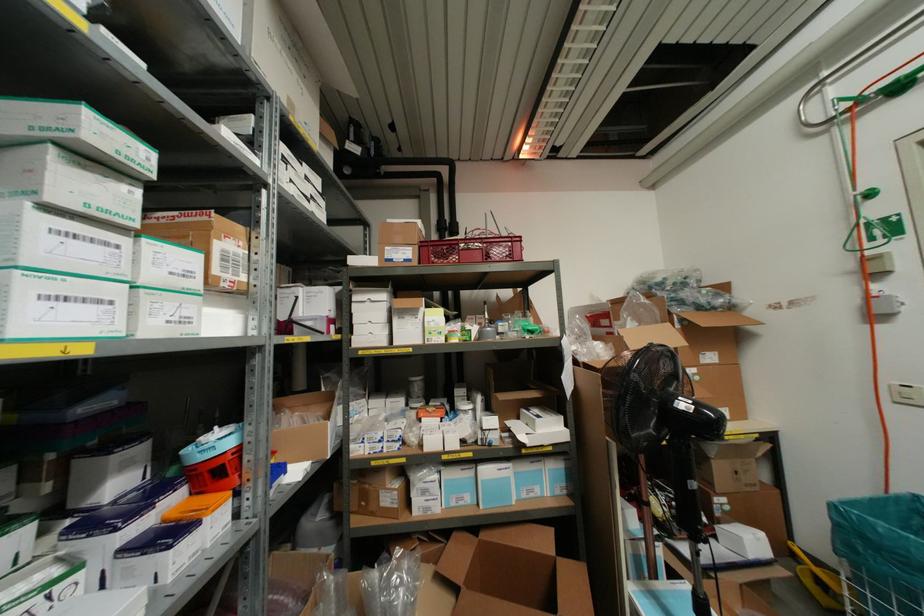
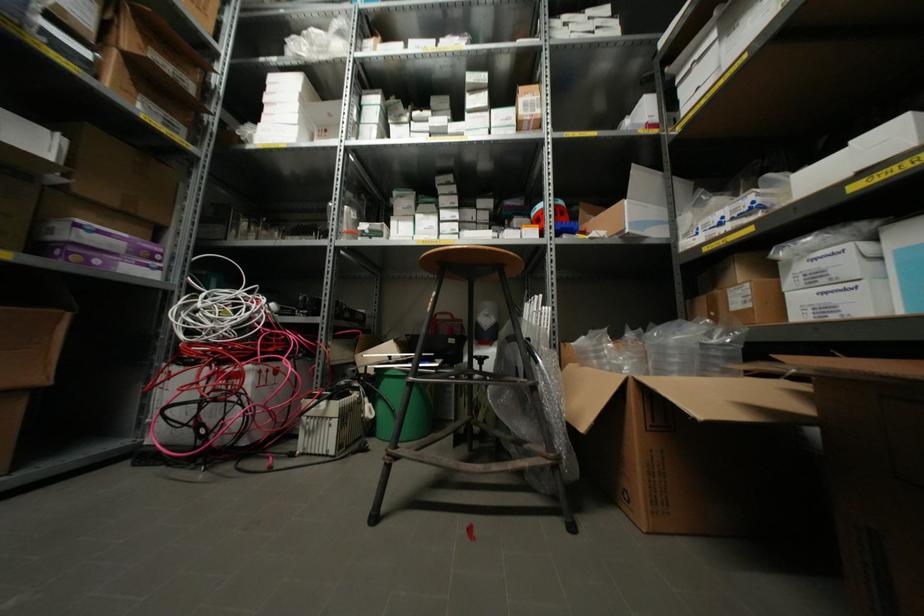
In the second image, find the point that corresponds to point (409, 350) in the first image.

(743, 55)